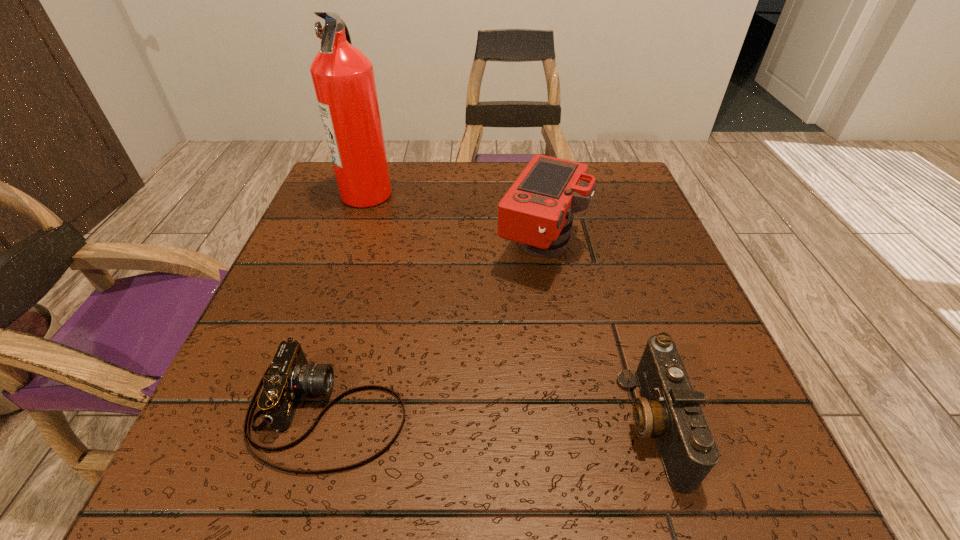
Image resolution: width=960 pixels, height=540 pixels. Find the location of `the tallest object`. the tallest object is located at coordinates (343, 77).

You are a GUI agent. You are given a task and a screenshot of the screen. Output one action in this format:
    pyautogui.click(x=<x>, y=<y>)
    Task: Click on the farthest object
    The image size is (960, 540).
    Given the screenshot: What is the action you would take?
    pyautogui.click(x=343, y=77)

Locate an element on the screen. the farthest camera is located at coordinates (537, 211).

Where is `the third nearest object`? The width and height of the screenshot is (960, 540). the third nearest object is located at coordinates (537, 211).

At what (x,y) coordinates should I click in order to perform the action: click on the second shortest object. Please return your answer as a coordinate pair (x, y). This screenshot has width=960, height=540. Looking at the image, I should click on (669, 409).

You are a GUI agent. You are given a task and a screenshot of the screen. Output one action in this format:
    pyautogui.click(x=<x>, y=<y>)
    Task: Click on the shortest camera
    
    Given the screenshot: What is the action you would take?
    pyautogui.click(x=289, y=376)

Where is `the leftmost camera`? This screenshot has width=960, height=540. the leftmost camera is located at coordinates (289, 376).

You are a GUI agent. You are given a task and a screenshot of the screen. Output one action in this format:
    pyautogui.click(x=<x>, y=<y>)
    Task: Click on the vacant space located at the nozzle of the tallest object
    The width and height of the screenshot is (960, 540).
    Given the screenshot: What is the action you would take?
    pyautogui.click(x=518, y=193)

The width and height of the screenshot is (960, 540). In order to click on free space located on the front of the second tallest object in this screenshot , I will do `click(569, 427)`.

The width and height of the screenshot is (960, 540). I want to click on vacant area situated on the front-facing side of the second shortest object, so click(446, 423).